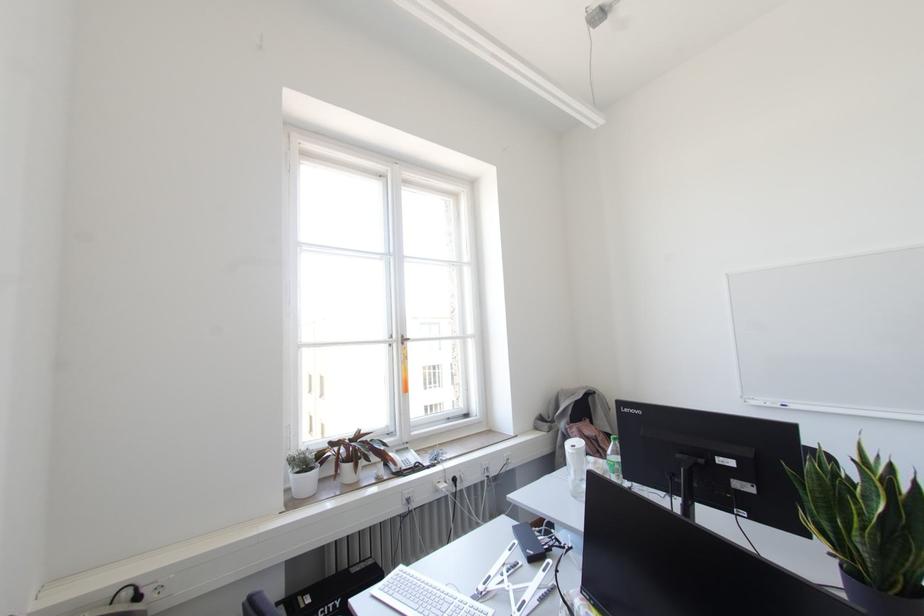
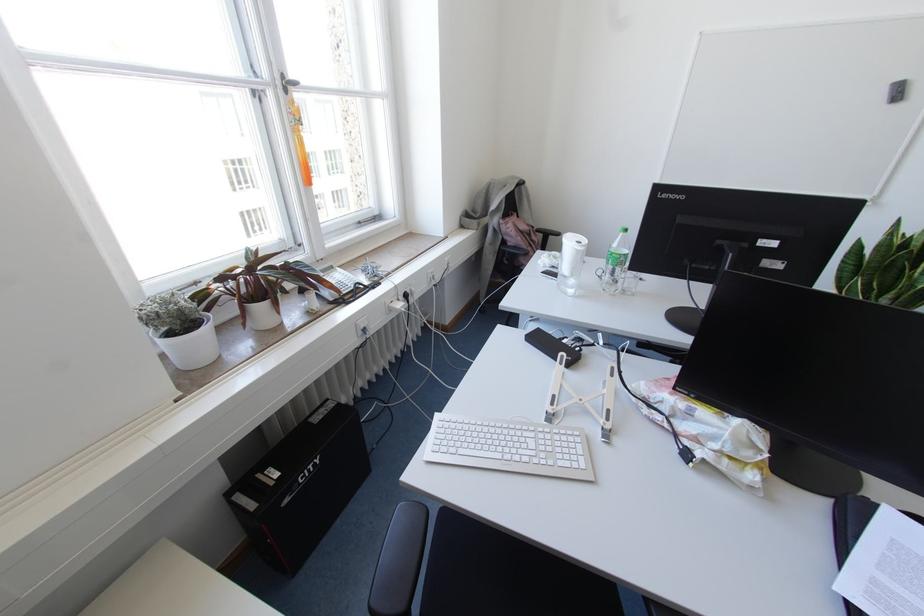
In the second image, find the point that corresponds to point (614, 438) in the first image.

(625, 229)